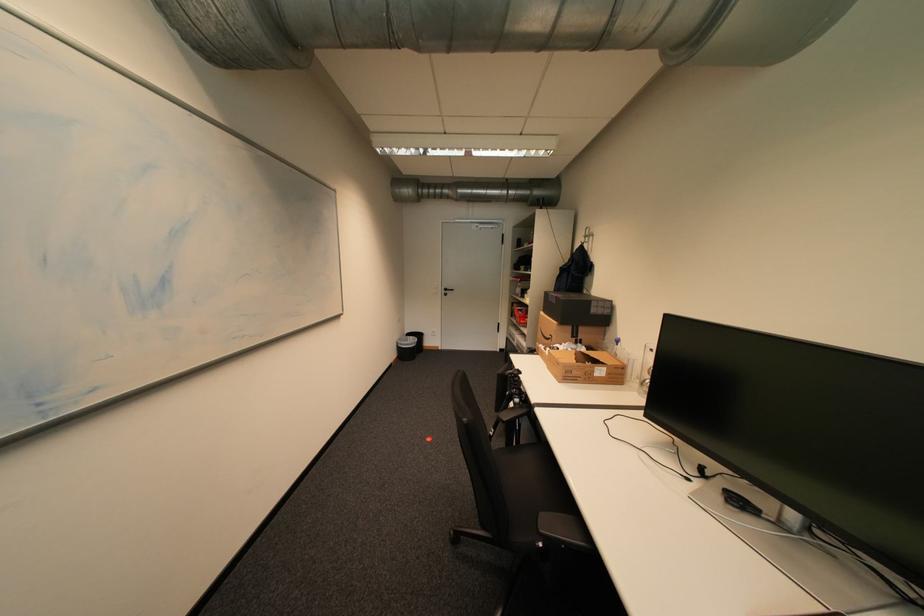
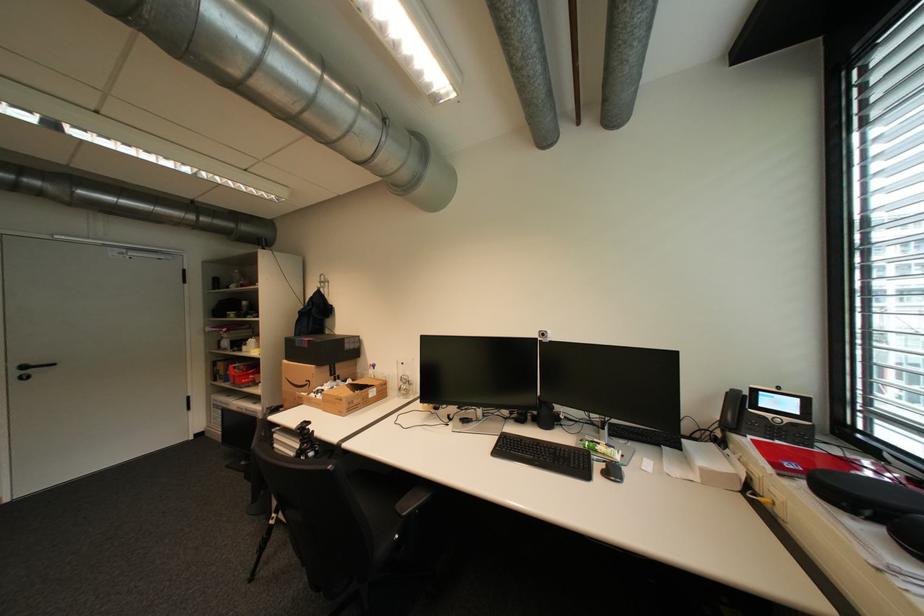
In the second image, find the point that corresponds to point (550, 545) in the first image.

(406, 537)